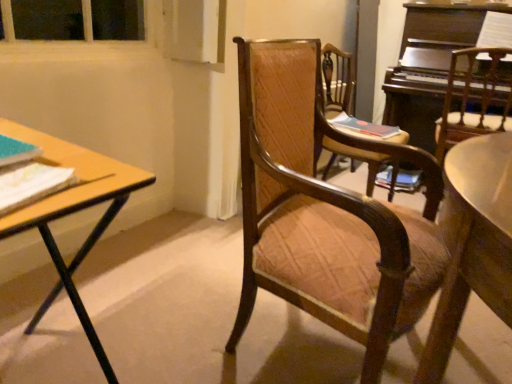
I want to click on matte blue book at left, which ranks as the 2th book in back-to-front order, so click(16, 151).

What do you see at coordinates (429, 65) in the screenshot?
I see `dark wood piano at upper right` at bounding box center [429, 65].

Where is `wooden desk at left`? The height and width of the screenshot is (384, 512). wooden desk at left is located at coordinates (72, 213).

Describe the element at coordinates (72, 213) in the screenshot. This screenshot has height=384, width=512. I see `wooden desk at left` at that location.

Describe the element at coordinates (474, 99) in the screenshot. I see `wooden chair at center, acting as the 3th chair starting from the left` at that location.

What is the approximate width of white paper at left, which is the first book from bottom to top?

The width of white paper at left, which is the first book from bottom to top, is 4.99 inches.

Where is `wooden textured chair at center, which appears as the second chair when viewed from the right`? The height and width of the screenshot is (384, 512). wooden textured chair at center, which appears as the second chair when viewed from the right is located at coordinates (337, 80).

Where is `matte blue book at left, positioned as the 1th book in left-to-right order`? matte blue book at left, positioned as the 1th book in left-to-right order is located at coordinates (16, 151).

Is point (6, 168) closer or farther from the camera than point (374, 125)?

Point (6, 168) appears to be closer to the viewer than point (374, 125).

From a real-world perspective, count 1st books upward from the matte pink book at center, acting as the third book starting from the front, and point to it. Please provide its 2D coordinates.

[(31, 184)]

Which of these two, white paper at left, placed as the second book when sorted from right to left, or matte pink book at center, the first book viewed from the back, is thinner?

With smaller width is white paper at left, placed as the second book when sorted from right to left.

Is dark wood piano at upper right thinner than wooden chair at center, the 3th chair in the right-to-left sequence?

No.

Is there a large distance between dark wood piano at upper right and wooden chair at center, the 3th chair in the right-to-left sequence?

dark wood piano at upper right is far away from wooden chair at center, the 3th chair in the right-to-left sequence.

Is wooden chair at center, the 3th chair in the right-to-left sequence, located within dark wood piano at upper right?

Definitely not — wooden chair at center, the 3th chair in the right-to-left sequence, is not inside dark wood piano at upper right.

Is dark wood piano at upper right oriented towards wooden chair at center, marked as the 1th chair in a left-to-right arrangement?

Yes.

Is wooden desk at left inside wooden textured chair at center, which is counted as the second chair, starting from the left?

No, wooden textured chair at center, which is counted as the second chair, starting from the left, does not contain wooden desk at left.

Can you confirm if wooden textured chair at center, which is counted as the second chair, starting from the left, is bigger than wooden desk at left?

Indeed, wooden textured chair at center, which is counted as the second chair, starting from the left, has a larger size compared to wooden desk at left.

Which chair is the 2nd one when counting from the back of the wooden desk at left? Please provide its 2D coordinates.

[(337, 80)]

Is wooden chair at center, marked as the 1th chair in a left-to-right arrangement, thinner than matte pink book at center, the first book from the right?

In fact, wooden chair at center, marked as the 1th chair in a left-to-right arrangement, might be wider than matte pink book at center, the first book from the right.

Looking at the image, does wooden chair at center, the 3th chair in the right-to-left sequence, seem bigger or smaller compared to matte pink book at center, which is the third book from bottom to top?

wooden chair at center, the 3th chair in the right-to-left sequence, is bigger than matte pink book at center, which is the third book from bottom to top.

Relative to matte pink book at center, the first book from the right, is wooden chair at center, marked as the 1th chair in a left-to-right arrangement, in front or behind?

wooden chair at center, marked as the 1th chair in a left-to-right arrangement, is in front of matte pink book at center, the first book from the right.

From a real-world perspective, starting from the wooden chair at center, the 3th chair in the right-to-left sequence, which book is the 1st one vertically above it? Please provide its 2D coordinates.

[(364, 126)]

This screenshot has height=384, width=512. I want to click on the 1st book in front of the wooden textured chair at center, which is counted as the second chair, starting from the left, so click(x=16, y=151).

Is matte blue book at left, which ranks as the 2th book in back-to-front order, inside wooden textured chair at center, which is counted as the second chair, starting from the left?

No, matte blue book at left, which ranks as the 2th book in back-to-front order, is located outside of wooden textured chair at center, which is counted as the second chair, starting from the left.

From a real-world perspective, is wooden textured chair at center, which is counted as the second chair, starting from the left, positioned over matte blue book at left, the 2th book from the front, based on gravity?

No.

In terms of size, does wooden chair at center, marked as the 1th chair in a left-to-right arrangement, appear bigger or smaller than white paper at left, the second book positioned from the left?

In the image, wooden chair at center, marked as the 1th chair in a left-to-right arrangement, appears to be larger than white paper at left, the second book positioned from the left.

The height and width of the screenshot is (384, 512). Identify the location of chair below the white paper at left, acting as the 3th book starting from the top (from the image's perspective). (325, 213).

From the image's perspective, is wooden chair at center, the 3th chair in the right-to-left sequence, located beneath white paper at left, which is the first book from bottom to top?

Indeed, from the image's perspective, wooden chair at center, the 3th chair in the right-to-left sequence, is shown beneath white paper at left, which is the first book from bottom to top.

Which chair is the 3rd one when counting from the right side of the matte blue book at left, which ranks as the 2th book in back-to-front order? Please provide its 2D coordinates.

[(474, 99)]

Considering the relative sizes of wooden chair at center, acting as the 3th chair starting from the left, and matte blue book at left, which is the 2th book in bottom-to-top order, in the image provided, is wooden chair at center, acting as the 3th chair starting from the left, wider than matte blue book at left, which is the 2th book in bottom-to-top order,?

Yes, wooden chair at center, acting as the 3th chair starting from the left, is wider than matte blue book at left, which is the 2th book in bottom-to-top order.

Which of these two, wooden chair at center, acting as the first chair starting from the right, or matte blue book at left, which is the 2th book in bottom-to-top order, stands taller?

Standing taller between the two is wooden chair at center, acting as the first chair starting from the right.

Would you say wooden chair at center, acting as the 3th chair starting from the left, is to the left or to the right of matte blue book at left, the 2th book from the front, in the picture?

Based on their positions, wooden chair at center, acting as the 3th chair starting from the left, is located to the right of matte blue book at left, the 2th book from the front.

This screenshot has height=384, width=512. There is a white paper at left, the 1th book in the front-to-back sequence. In order to click on the 2nd book above it (from the image's perspective) in this screenshot , I will do `click(364, 126)`.

Where is `piano behind the wooden chair at center, marked as the 1th chair in a left-to-right arrangement`? The image size is (512, 384). piano behind the wooden chair at center, marked as the 1th chair in a left-to-right arrangement is located at coordinates (429, 65).

Considering their positions, is matte pink book at center, which is the third book from bottom to top, positioned closer to white paper at left, placed as the second book when sorted from right to left, than wooden chair at center, acting as the first chair starting from the right?

matte pink book at center, which is the third book from bottom to top, lies closer to white paper at left, placed as the second book when sorted from right to left, than the other object.

Considering their positions, is dark wood piano at upper right positioned further to wooden textured chair at center, which is counted as the second chair, starting from the left, than white paper at left, which is the first book from bottom to top?

white paper at left, which is the first book from bottom to top, lies further to wooden textured chair at center, which is counted as the second chair, starting from the left, than the other object.

Estimate the real-world distances between objects in this image. Which object is further from matte pink book at center, acting as the third book starting from the front, matte blue book at left, which appears as the second book when viewed from the top, or wooden chair at center, the 3th chair in the right-to-left sequence?

matte blue book at left, which appears as the second book when viewed from the top, is positioned further to the anchor matte pink book at center, acting as the third book starting from the front.

When comparing their distances from wooden textured chair at center, which is counted as the second chair, starting from the left, does wooden chair at center, the 3th chair in the right-to-left sequence, or wooden chair at center, acting as the first chair starting from the right, seem further?

wooden chair at center, the 3th chair in the right-to-left sequence, is positioned further to the anchor wooden textured chair at center, which is counted as the second chair, starting from the left.

From the image, which object appears to be farther from wooden chair at center, acting as the 3th chair starting from the left, wooden textured chair at center, which is counted as the second chair, starting from the left, or wooden desk at left?

Among the two, wooden desk at left is located further to wooden chair at center, acting as the 3th chair starting from the left.

Based on their spatial positions, is matte blue book at left, positioned as the 1th book in left-to-right order, or matte pink book at center, acting as the third book starting from the front, further from wooden chair at center, acting as the 3th chair starting from the left?

The object further to wooden chair at center, acting as the 3th chair starting from the left, is matte blue book at left, positioned as the 1th book in left-to-right order.

Consider the image. Which object lies further to the anchor point matte pink book at center, which is the third book from bottom to top, wooden chair at center, the 3th chair in the right-to-left sequence, or white paper at left, the second book positioned from the left?

Among the two, white paper at left, the second book positioned from the left, is located further to matte pink book at center, which is the third book from bottom to top.

From the picture: When comparing their distances from matte blue book at left, the 3th book in the right-to-left sequence, does wooden chair at center, acting as the 3th chair starting from the left, or wooden textured chair at center, which is counted as the second chair, starting from the left, seem further?

wooden chair at center, acting as the 3th chair starting from the left, is positioned further to the anchor matte blue book at left, the 3th book in the right-to-left sequence.

The height and width of the screenshot is (384, 512). I want to click on desk between matte blue book at left, the 2th book from the front, and wooden chair at center, acting as the 3th chair starting from the left, in the horizontal direction, so 72,213.

At what (x,y) coordinates should I click in order to perform the action: click on chair between matte pink book at center, which is the third book from bottom to top, and dark wood piano at upper right, in the horizontal direction. Please return your answer as a coordinate pair (x, y). Looking at the image, I should click on (474, 99).

Where is `book between wooden textured chair at center, which appears as the second chair when viewed from the right, and dark wood piano at upper right, in the horizontal direction`? Image resolution: width=512 pixels, height=384 pixels. book between wooden textured chair at center, which appears as the second chair when viewed from the right, and dark wood piano at upper right, in the horizontal direction is located at coordinates (364, 126).

The width and height of the screenshot is (512, 384). In order to click on book between matte blue book at left, which appears as the second book when viewed from the top, and wooden desk at left in the up-down direction in this screenshot , I will do `click(31, 184)`.